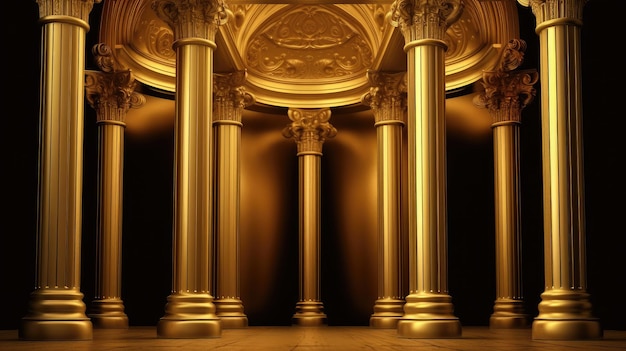
The width and height of the screenshot is (626, 351). What are the coordinates of `column` in the screenshot? It's located at (69, 144), (116, 158), (191, 168), (231, 162), (319, 199), (390, 191), (504, 160), (565, 154).